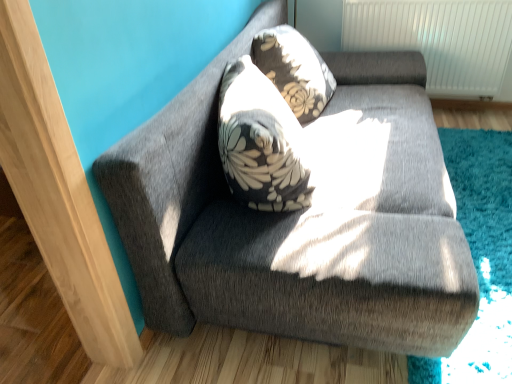
Question: Is floral-patterned fabric pillow at upper center in front of or behind textured gray couch at upper center in the image?

Choices:
 (A) behind
 (B) front

Answer: (A)

Question: Visually, is floral-patterned fabric pillow at upper center positioned to the left or to the right of textured gray couch at upper center?

Choices:
 (A) left
 (B) right

Answer: (A)

Question: Is floral-patterned fabric pillow at upper center taller or shorter than textured gray couch at upper center?

Choices:
 (A) short
 (B) tall

Answer: (A)

Question: Based on their positions, is textured gray couch at upper center located to the left or right of floral-patterned fabric pillow at upper center?

Choices:
 (A) right
 (B) left

Answer: (A)

Question: Looking at the image, does textured gray couch at upper center seem bigger or smaller compared to floral-patterned fabric pillow at upper center?

Choices:
 (A) small
 (B) big

Answer: (B)

Question: From a real-world perspective, is textured gray couch at upper center physically located above or below floral-patterned fabric pillow at upper center?

Choices:
 (A) above
 (B) below

Answer: (B)

Question: Is textured gray couch at upper center wider or thinner than floral-patterned fabric pillow at upper center?

Choices:
 (A) thin
 (B) wide

Answer: (B)